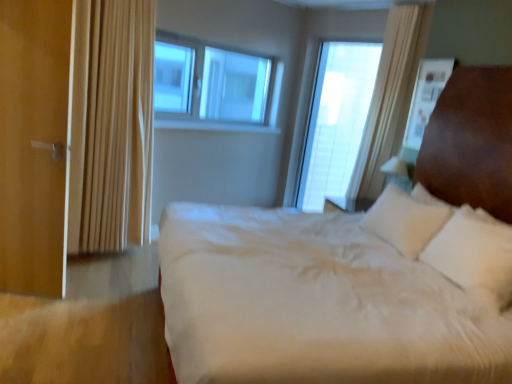
Question: From the image's perspective, is transparent glass window at center, which ranks as the first window in left-to-right order, beneath matte wood door at left?

Choices:
 (A) no
 (B) yes

Answer: (A)

Question: Is transparent glass window at center, arranged as the 2th window when viewed from the right, directly adjacent to matte wood door at left?

Choices:
 (A) yes
 (B) no

Answer: (B)

Question: Can we say transparent glass window at center, arranged as the 2th window when viewed from the right, lies outside matte wood door at left?

Choices:
 (A) no
 (B) yes

Answer: (B)

Question: Is transparent glass window at center, arranged as the 2th window when viewed from the right, not near matte wood door at left?

Choices:
 (A) no
 (B) yes

Answer: (B)

Question: Is transparent glass window at center, which ranks as the first window in left-to-right order, turned away from matte wood door at left?

Choices:
 (A) yes
 (B) no

Answer: (B)

Question: In terms of width, does white soft bed at center look wider or thinner when compared to transparent glass window at center, arranged as the 2th window when viewed from the right?

Choices:
 (A) wide
 (B) thin

Answer: (A)

Question: From a real-world perspective, relative to transparent glass window at center, which ranks as the first window in left-to-right order, is white soft bed at center vertically above or below?

Choices:
 (A) below
 (B) above

Answer: (A)

Question: Would you say white soft bed at center is to the left or to the right of transparent glass window at center, arranged as the 2th window when viewed from the right, in the picture?

Choices:
 (A) right
 (B) left

Answer: (A)

Question: From the image's perspective, relative to transparent glass window at center, which ranks as the first window in left-to-right order, is white soft bed at center above or below?

Choices:
 (A) above
 (B) below

Answer: (B)

Question: Considering the positions of transparent glass window at center, arranged as the 2th window when viewed from the right, and transparent glass window at center, which ranks as the 2th window in left-to-right order, in the image, is transparent glass window at center, arranged as the 2th window when viewed from the right, taller or shorter than transparent glass window at center, which ranks as the 2th window in left-to-right order,?

Choices:
 (A) tall
 (B) short

Answer: (B)

Question: Is transparent glass window at center, arranged as the 2th window when viewed from the right, wider or thinner than transparent glass window at center, which ranks as the 2th window in left-to-right order?

Choices:
 (A) wide
 (B) thin

Answer: (B)

Question: Is transparent glass window at center, arranged as the 2th window when viewed from the right, to the left or to the right of transparent glass window at center, which ranks as the 2th window in left-to-right order, in the image?

Choices:
 (A) left
 (B) right

Answer: (A)

Question: From a real-world perspective, is transparent glass window at center, arranged as the 2th window when viewed from the right, positioned above or below transparent glass window at center, which ranks as the 2th window in left-to-right order?

Choices:
 (A) above
 (B) below

Answer: (A)

Question: Would you say transparent glass window at center, which ranks as the first window in left-to-right order, is to the left or to the right of white soft bed at center in the picture?

Choices:
 (A) left
 (B) right

Answer: (A)

Question: Choose the correct answer: Is transparent glass window at center, which ranks as the first window in left-to-right order, inside white soft bed at center or outside it?

Choices:
 (A) inside
 (B) outside

Answer: (B)